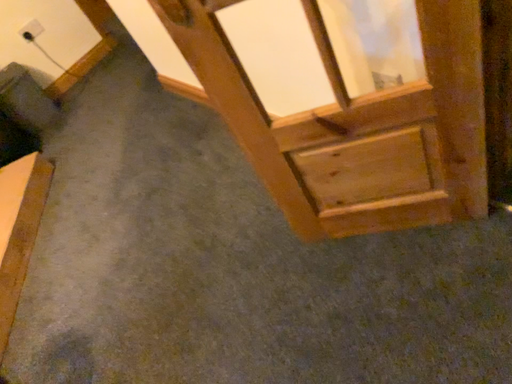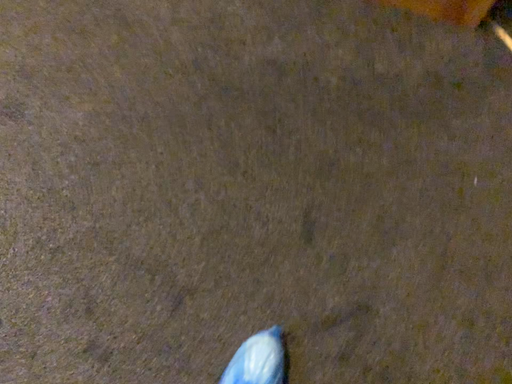
Question: How did the camera likely rotate when shooting the video?

Choices:
 (A) rotated upward
 (B) rotated downward

Answer: (B)